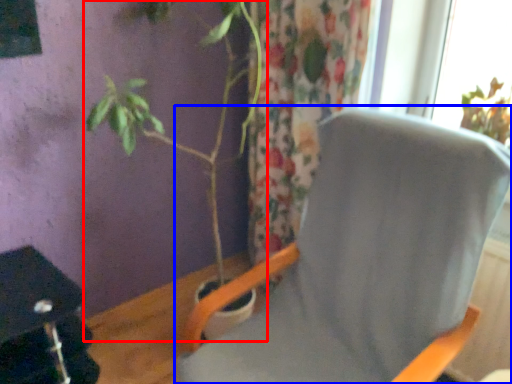
Question: Which object appears farthest to the camera in this image, houseplant (highlighted by a red box) or chair (highlighted by a blue box)?

Choices:
 (A) houseplant
 (B) chair

Answer: (A)